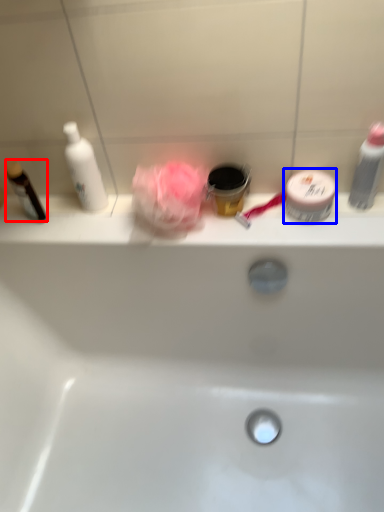
Question: Which of the following is the farthest to the observer, toiletry (highlighted by a red box) or toiletry (highlighted by a blue box)?

Choices:
 (A) toiletry
 (B) toiletry

Answer: (A)